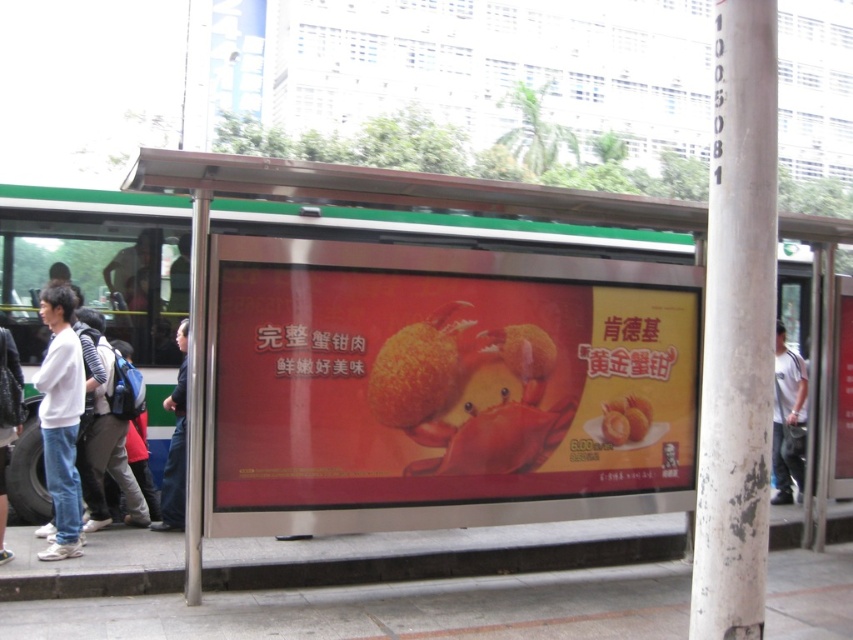
You are a photographer at the bus stop and want to capture a photo of the white cotton shirt at right and the dark blue jeans at lower left. Based on their positions, which object should you focus on first to ensure both are in the frame?

The white cotton shirt at right is positioned under the dark blue jeans at lower left, so you should focus on the dark blue jeans at lower left first to ensure both are in the frame.